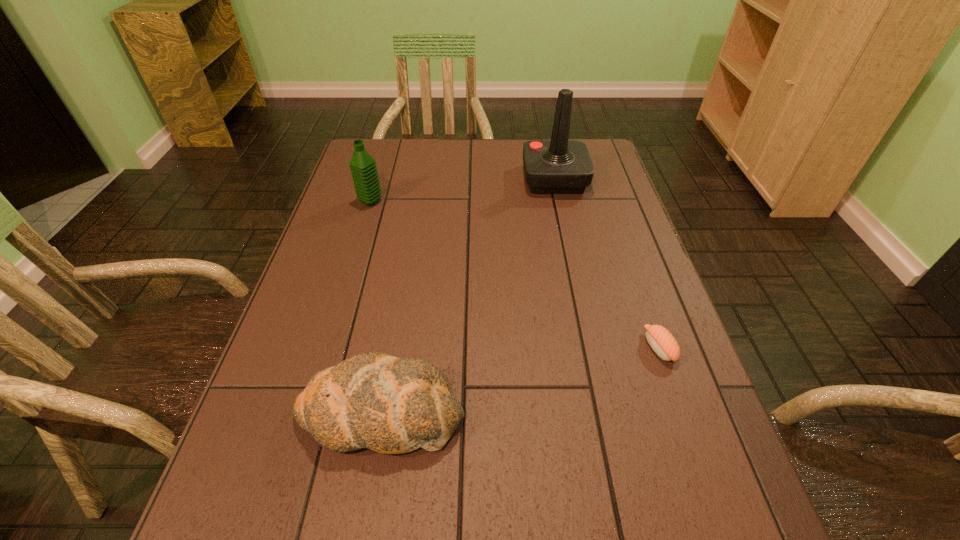
Find the location of a particular element. The width and height of the screenshot is (960, 540). vacant area situated on the left of the rightmost object is located at coordinates (554, 347).

Identify the location of object located at the far edge. (x=557, y=166).

The image size is (960, 540). I want to click on water bottle that is at the left edge, so click(x=363, y=167).

Find the location of a particular element. The width and height of the screenshot is (960, 540). bread that is at the left edge is located at coordinates (391, 405).

You are a GUI agent. You are given a task and a screenshot of the screen. Output one action in this format:
    pyautogui.click(x=<x>, y=<y>)
    Task: Click on the joystick located in the right edge section of the desktop
    
    Given the screenshot: What is the action you would take?
    pyautogui.click(x=557, y=166)

I want to click on sushi that is at the right edge, so click(659, 338).

Locate an element on the screen. The height and width of the screenshot is (540, 960). object that is at the far right corner is located at coordinates tap(557, 166).

Image resolution: width=960 pixels, height=540 pixels. Find the location of `free space at the far edge of the desktop`. free space at the far edge of the desktop is located at coordinates (426, 153).

The height and width of the screenshot is (540, 960). In order to click on vacant space at the left edge of the desktop in this screenshot , I will do `click(342, 214)`.

This screenshot has width=960, height=540. I want to click on vacant space at the right edge of the desktop, so click(596, 258).